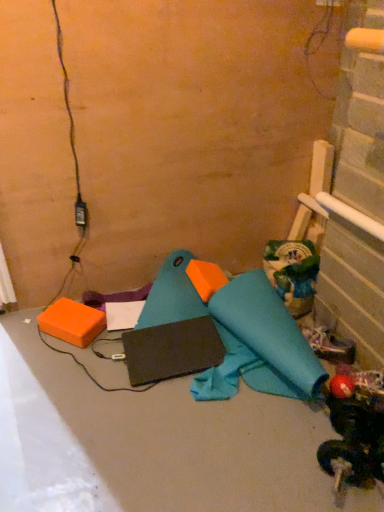
Identify the location of free spot above orange foam block at lower left (from a real-world perspective). Image resolution: width=384 pixels, height=512 pixels. (67, 312).